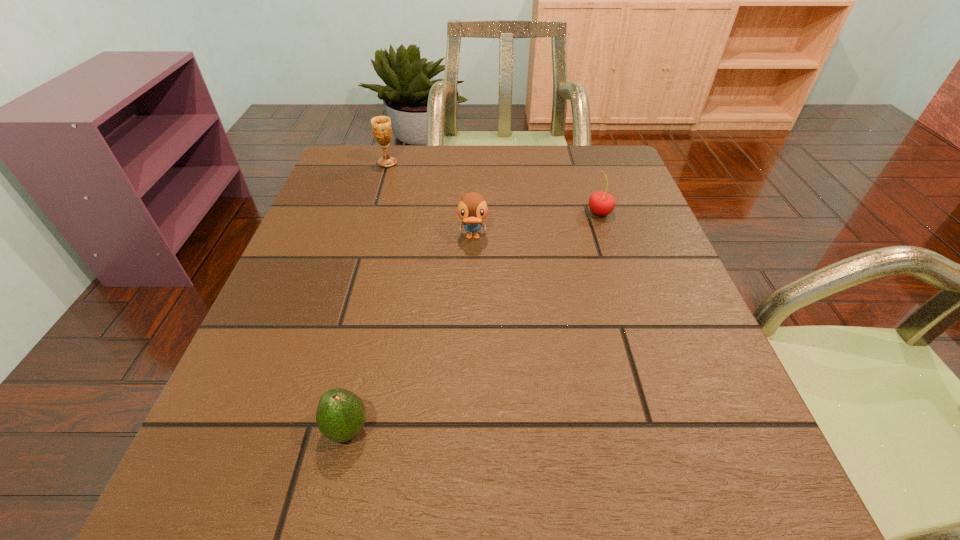
The image size is (960, 540). In order to click on object situated at the far edge in this screenshot , I will do `click(381, 125)`.

Identify the location of object that is at the left edge. The image size is (960, 540). (381, 125).

The width and height of the screenshot is (960, 540). I want to click on object located in the right edge section of the desktop, so click(601, 203).

Locate an element on the screen. The image size is (960, 540). object positioned at the far left corner is located at coordinates (381, 125).

In the image, there is a desktop. At what (x,y) coordinates should I click in order to perform the action: click on vacant area at the far edge. Please return your answer as a coordinate pair (x, y). Looking at the image, I should click on (412, 146).

At what (x,y) coordinates should I click in order to perform the action: click on vacant space at the right edge of the desktop. Please return your answer as a coordinate pair (x, y). Looking at the image, I should click on (648, 332).

You are a GUI agent. You are given a task and a screenshot of the screen. Output one action in this format:
    pyautogui.click(x=<x>, y=<y>)
    Task: Click on the vacant area at the far left corner
    The image size is (960, 540).
    Given the screenshot: What is the action you would take?
    pyautogui.click(x=396, y=158)

Image resolution: width=960 pixels, height=540 pixels. Identify the location of free space at the near left corner. (270, 512).

The height and width of the screenshot is (540, 960). In order to click on vacant space at the near right corner in this screenshot , I will do `click(778, 480)`.

You are a GUI agent. You are given a task and a screenshot of the screen. Output one action in this format:
    pyautogui.click(x=<x>, y=<y>)
    Task: Click on the vacant space that is in between the avocado and the chalice
    
    Given the screenshot: What is the action you would take?
    click(x=368, y=296)